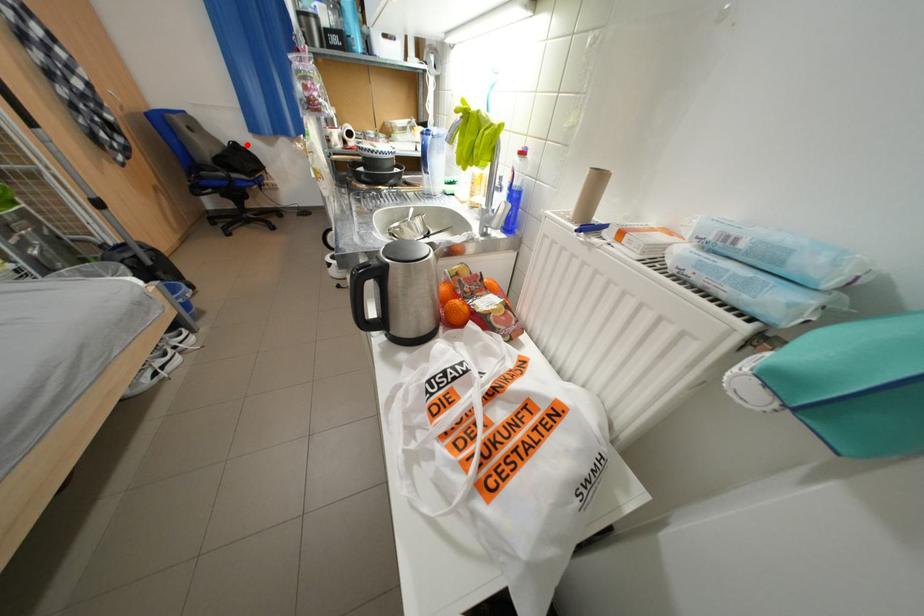
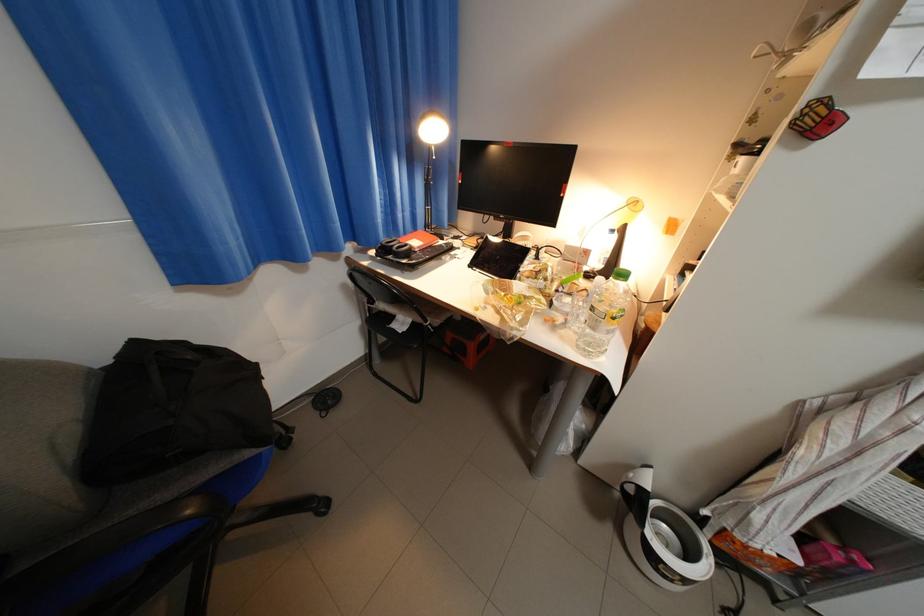
The point at the highlighted location is marked in the first image. Where is the corresponding point in the second image?

(147, 344)